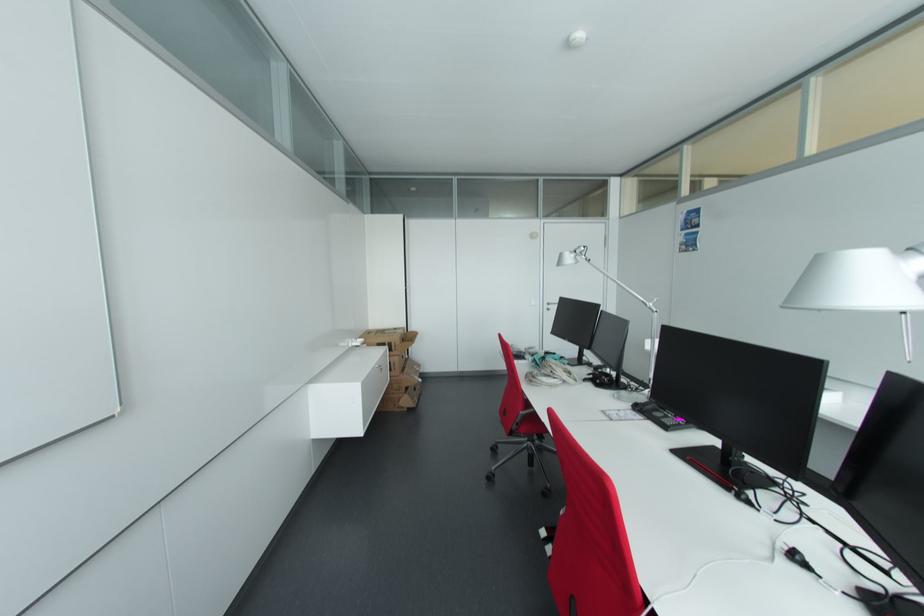
In order to click on silver lamp head in this screenshot , I will do `click(859, 282)`.